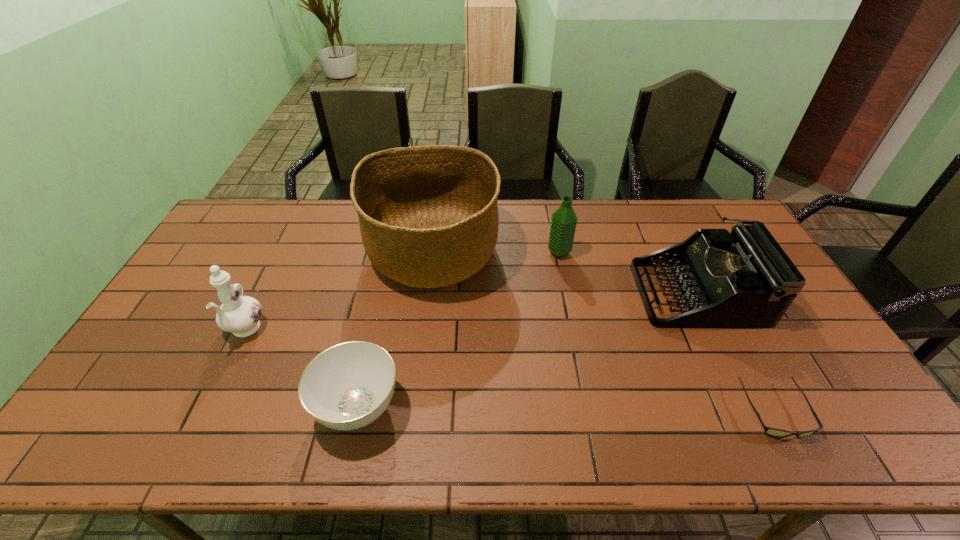
What are the coordinates of `vacant space located 0.260m on the back of the third object from right to left` in the screenshot? It's located at (549, 202).

Identify the location of free space located 0.270m on the typing side of the typewriter. (551, 293).

Locate an element on the screen. vacant space located on the typing side of the typewriter is located at coordinates (525, 293).

Where is `vacant region located on the typing side of the typewriter`? Image resolution: width=960 pixels, height=540 pixels. vacant region located on the typing side of the typewriter is located at coordinates (532, 293).

The image size is (960, 540). Identify the location of free region located 0.070m on the left of the shorter chinaware. (285, 407).

I want to click on object that is at the far edge, so click(x=428, y=215).

Image resolution: width=960 pixels, height=540 pixels. Find the location of `chinaware that is at the near edge`. chinaware that is at the near edge is located at coordinates (348, 386).

This screenshot has height=540, width=960. In order to click on sunglasses that is at the near edge in this screenshot , I will do `click(774, 432)`.

Find the location of a particular element. The width and height of the screenshot is (960, 540). typewriter located in the right edge section of the desktop is located at coordinates (743, 279).

Find the location of a particular element. This screenshot has height=540, width=960. sunglasses that is at the right edge is located at coordinates (774, 432).